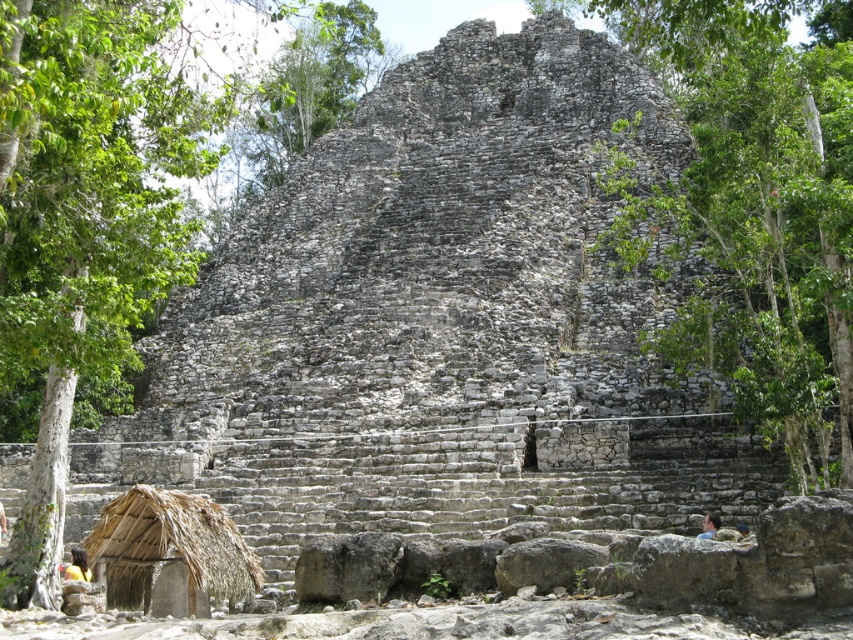
Question: Is green leafy tree at center to the left of brown thatch hut at lower left from the viewer's perspective?

Choices:
 (A) yes
 (B) no

Answer: (B)

Question: Does green leafy tree at center-left have a lesser width compared to brown thatch hut at lower left?

Choices:
 (A) no
 (B) yes

Answer: (A)

Question: Considering the real-world distances, which object is closest to the green leafy tree at center?

Choices:
 (A) brown thatch hut at lower left
 (B) green leafy tree at center-left

Answer: (B)

Question: Among these points, which one is nearest to the camera?

Choices:
 (A) (103, 529)
 (B) (672, 51)
 (C) (65, 301)

Answer: (C)

Question: Is green leafy tree at center thinner than green leafy tree at center-left?

Choices:
 (A) no
 (B) yes

Answer: (A)

Question: Which point is farther from the camera taking this photo?

Choices:
 (A) (355, 19)
 (B) (828, 305)
 (C) (103, 564)

Answer: (A)